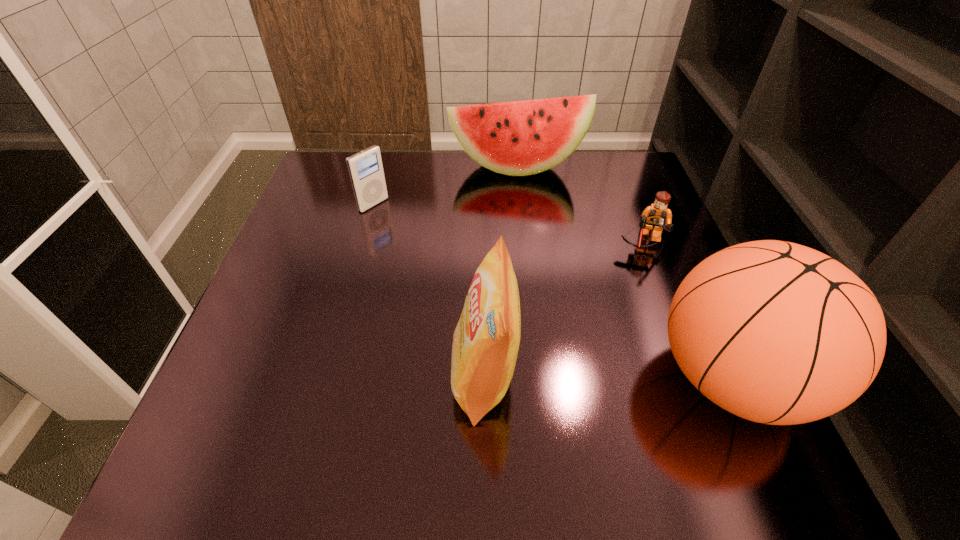
Where is `free location at the far edge`? free location at the far edge is located at coordinates (401, 161).

The image size is (960, 540). What are the coordinates of `blank space at the near edge of the desktop` in the screenshot? It's located at (636, 410).

Locate an element on the screen. The width and height of the screenshot is (960, 540). vacant space at the left edge of the desktop is located at coordinates (300, 253).

Locate an element on the screen. free region at the near left corner is located at coordinates (235, 406).

In order to click on vacant space at the far right corner of the desktop in this screenshot , I will do `click(582, 158)`.

The width and height of the screenshot is (960, 540). I want to click on free space that is in between the basketball and the third shortest object, so click(x=624, y=272).

Find the location of a particular element. This screenshot has width=960, height=540. free area in between the shortest object and the iPod is located at coordinates (509, 224).

Where is `empty space between the crisp (potato chip) and the basketball`? This screenshot has height=540, width=960. empty space between the crisp (potato chip) and the basketball is located at coordinates (608, 377).

Image resolution: width=960 pixels, height=540 pixels. Identify the location of free space between the third shortest object and the Lego. (581, 205).

I want to click on vacant region between the shortest object and the second farthest object, so click(x=509, y=224).